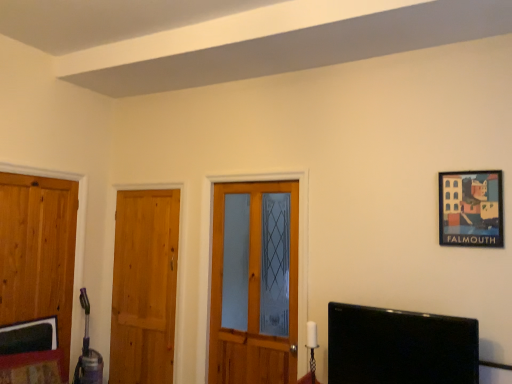
Question: Is wooden door at left, the first door from the left, in front of or behind black glossy tv at lower right in the image?

Choices:
 (A) front
 (B) behind

Answer: (B)

Question: Looking at the image, does wooden door at left, the first door from the left, seem bigger or smaller compared to black glossy tv at lower right?

Choices:
 (A) big
 (B) small

Answer: (B)

Question: Estimate the real-world distances between objects in this image. Which object is closer to the wooden door at center, the third door when ordered from left to right?

Choices:
 (A) wooden door at left, which ranks as the 2th door in left-to-right order
 (B) black glossy tv at lower right
 (C) wooden framed picture at upper right
 (D) wooden door at left, the first door from the left

Answer: (A)

Question: Which object is positioned closest to the wooden framed picture at upper right?

Choices:
 (A) wooden door at center, the 1th door viewed from the right
 (B) wooden door at left, which is the 2th door from right to left
 (C) wooden door at left, the first door from the left
 (D) black glossy tv at lower right

Answer: (D)